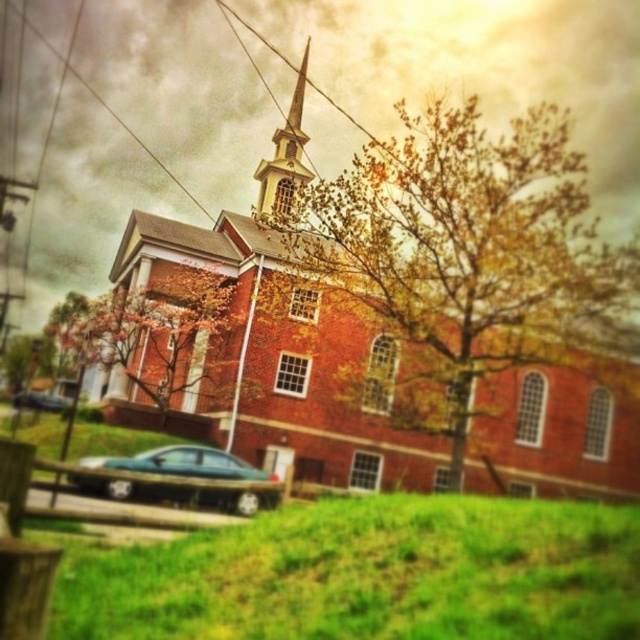
You are a delivery person needing to park your 5.5 meter long truck between the metallic teal sedan at lower center and the metallic blue sedan at lower left. Can you fit your truck in that space?

The metallic teal sedan at lower center and metallic blue sedan at lower left are 24.35 meters apart from each other. Since your truck is 5.5 meters long, there is enough space to park between them.

You are standing in front of the church and want to take a photo of the entire building without any obstructions. The metallic teal sedan at lower center is parked nearby. Based on its 2D location coordinates, can you estimate whether the car is blocking the view of the church?

The metallic teal sedan at lower center is located at coordinates (182, 464), which is in the lower center area. Since the tree is in front of the church and the car is at lower center, it is likely not blocking the church itself but might be near the base. However, without knowing the exact size and orientation of the car relative to the church, it is hard to say definitively. But according to the given information, the tree is the one partially obscuring the view, so the car may not be blocking the main

You are standing at the center of the image and want to walk towards the metallic teal sedan at lower center. According to the coordinates provided, in which direction should you move?

The metallic teal sedan at lower center is located at coordinates point (182, 464). Since the sedan is at lower center, you should move downward from the center to reach it.